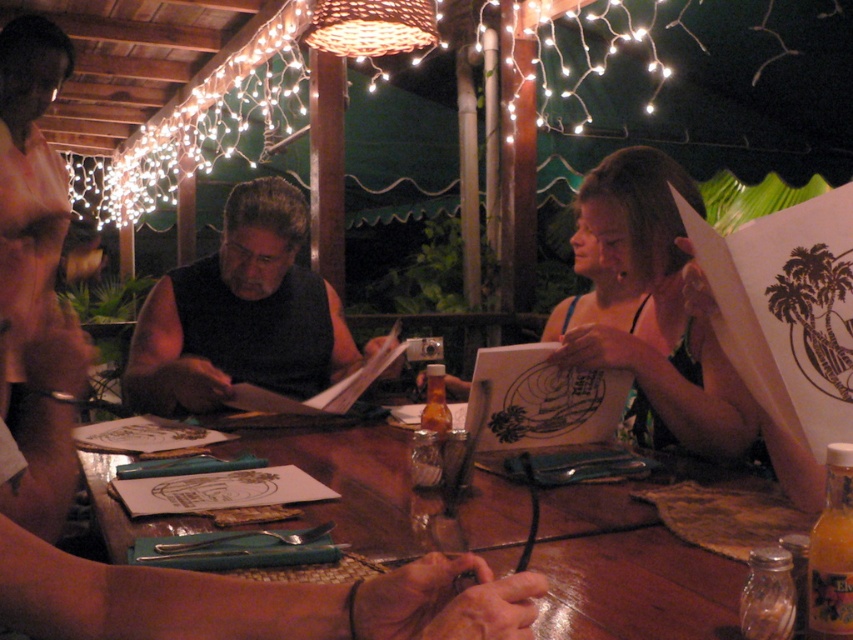
Question: Is black matte shirt at center to the right of matte green bikini top at upper right from the viewer's perspective?

Choices:
 (A) yes
 (B) no

Answer: (B)

Question: Considering the real-world distances, which object is closest to the matte green bikini top at upper right?

Choices:
 (A) wooden table at center
 (B) black matte shirt at center

Answer: (A)

Question: Which point is farther to the camera?

Choices:
 (A) (717, 452)
 (B) (196, 282)
 (C) (343, 451)

Answer: (B)

Question: Which point is closer to the camera taking this photo?

Choices:
 (A) (647, 248)
 (B) (164, 360)
 (C) (329, 451)

Answer: (A)

Question: Can you confirm if wooden table at center is positioned above matte green bikini top at upper right?

Choices:
 (A) yes
 (B) no

Answer: (B)

Question: Is wooden table at center wider than black matte shirt at center?

Choices:
 (A) no
 (B) yes

Answer: (B)